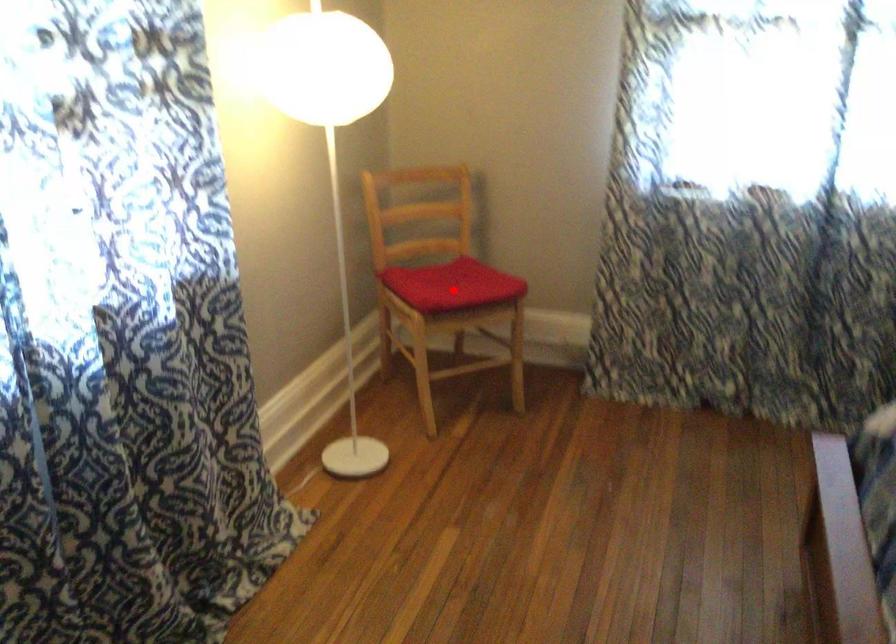
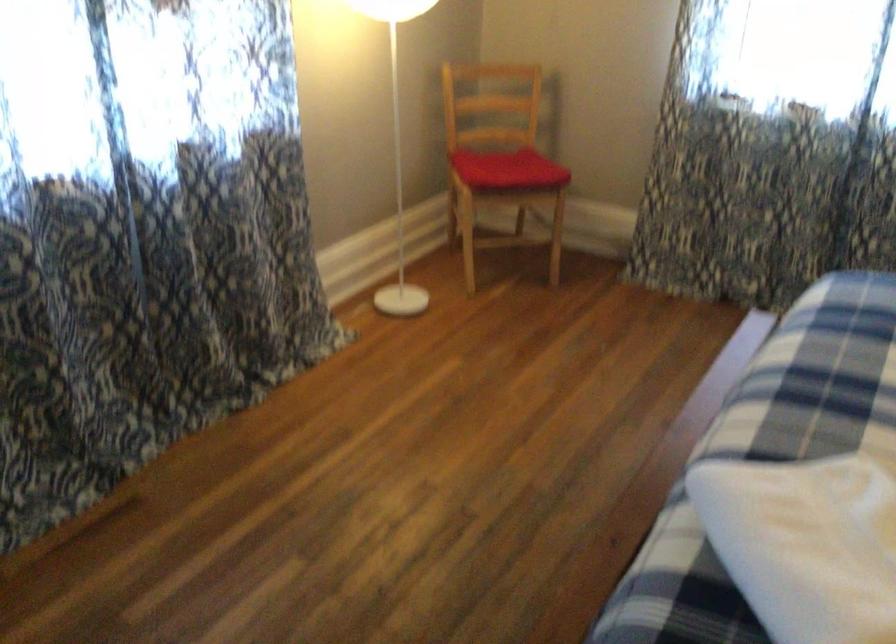
Question: I am providing you with two images of the same scene from different viewpoints. Image1 has a red point marked. In image2, the corresponding 3D location appears at what relative position? Reply with the corresponding letter.

Choices:
 (A) Closer
 (B) Farther

Answer: (B)